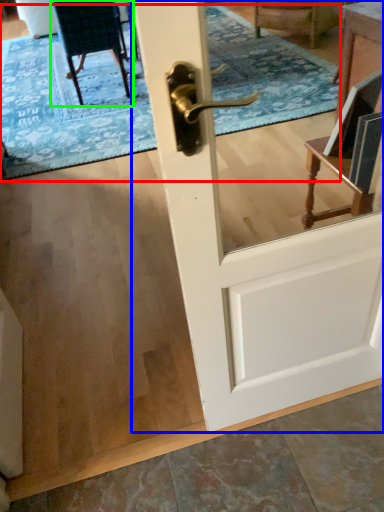
Question: Which object is positioned closest to doormat (highlighted by a red box)? Select from door (highlighted by a blue box) and chair (highlighted by a green box).

Choices:
 (A) door
 (B) chair

Answer: (B)